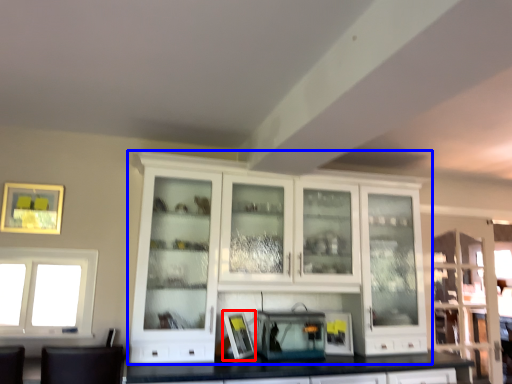
Question: Which object appears farthest to the camera in this image, picture frame (highlighted by a red box) or cabinetry (highlighted by a blue box)?

Choices:
 (A) picture frame
 (B) cabinetry

Answer: (A)